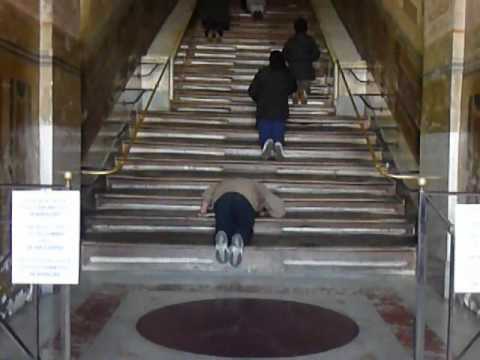
Where is `stairs`? The image size is (480, 360). stairs is located at coordinates pos(186,205).